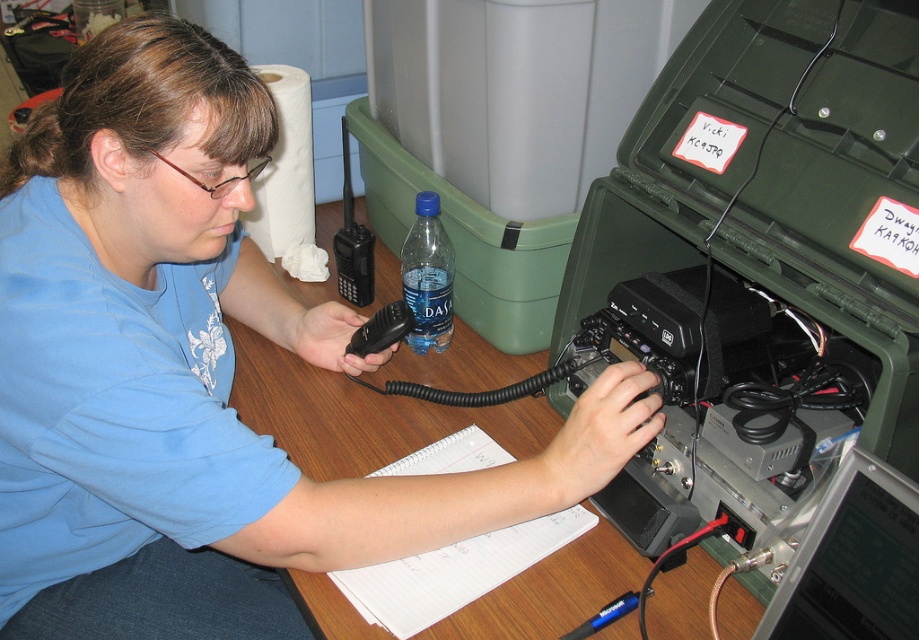
Can you confirm if matte black radio at center is wider than blue plastic bottle at center?

Indeed, matte black radio at center has a greater width compared to blue plastic bottle at center.

Who is shorter, matte black radio at center or blue plastic bottle at center?

blue plastic bottle at center is shorter.

Image resolution: width=919 pixels, height=640 pixels. I want to click on matte black radio at center, so click(x=195, y=372).

Between black plastic walkie-talkie at upper left and black plastic handheld radio at center, which one has more height?

black plastic walkie-talkie at upper left is taller.

This screenshot has height=640, width=919. In order to click on black plastic walkie-talkie at upper left in this screenshot , I will do `click(352, 241)`.

I want to click on black plastic walkie-talkie at upper left, so click(352, 241).

Can you confirm if blue plastic bottle at center is positioned below black plastic handheld radio at center?

Actually, blue plastic bottle at center is above black plastic handheld radio at center.

Can you confirm if blue plastic bottle at center is positioned above black plastic handheld radio at center?

Yes.

At what (x,y) coordinates should I click in order to perform the action: click on blue plastic bottle at center. Please return your answer as a coordinate pair (x, y). The image size is (919, 640). Looking at the image, I should click on (427, 276).